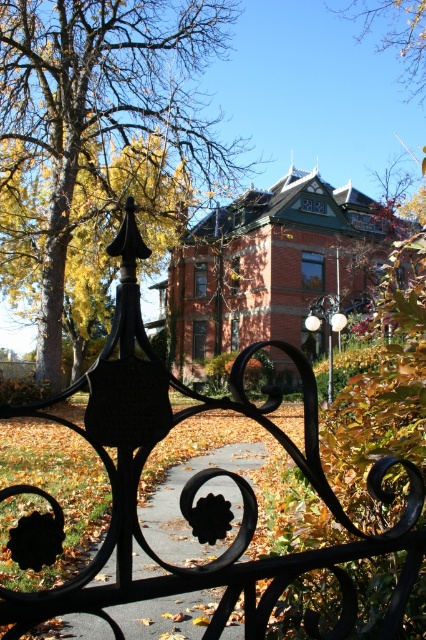
You are standing in front of the Victorian house and want to take a photo that includes both the brown leafy tree at upper left and the black wrought iron gate. Based on their positions, where should you position yourself to ensure both elements are in the frame?

Since the brown leafy tree at upper left is located at point (98, 115), you should position yourself to the left side of the scene to include both the tree and the gate in your photo.

From the picture: You are standing in front of the Victorian house and notice two points marked in the image. The first point is at coordinate point(204, 595) and the second is at point(414, 44). Which point is nearer to your current position?

Point(204, 595) is closer to the camera than point(414, 44), so the first point is nearer to your current position.

You are standing in front of the Victorian house and notice two trees in the scene. Which tree, the brown leafy tree at upper left or the brown leafy tree at upper center, is closer to you?

The brown leafy tree at upper left is closer to you because it is in front of the brown leafy tree at upper center.